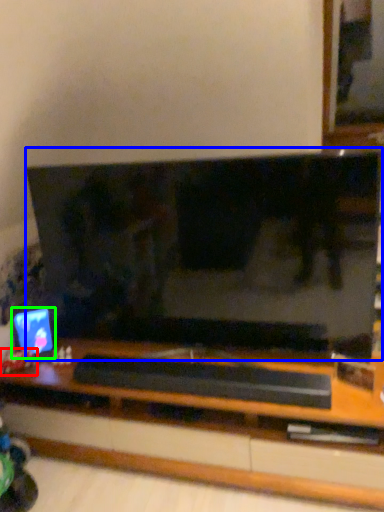
Question: Which is farther away from toy (highlighted by a red box)? television (highlighted by a blue box) or computer monitor (highlighted by a green box)?

Choices:
 (A) television
 (B) computer monitor

Answer: (A)